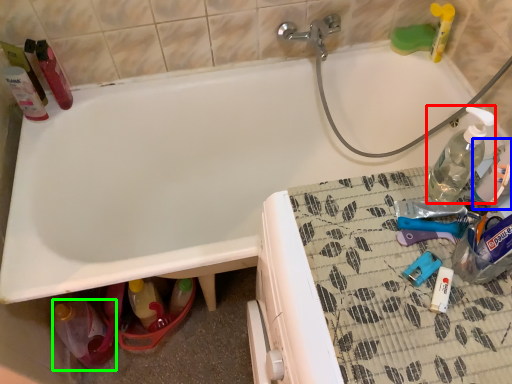
Question: Estimate the real-world distances between objects in this image. Which object is farther from bottle (highlighted by a red box), bottle (highlighted by a blue box) or bottle (highlighted by a green box)?

Choices:
 (A) bottle
 (B) bottle

Answer: (B)